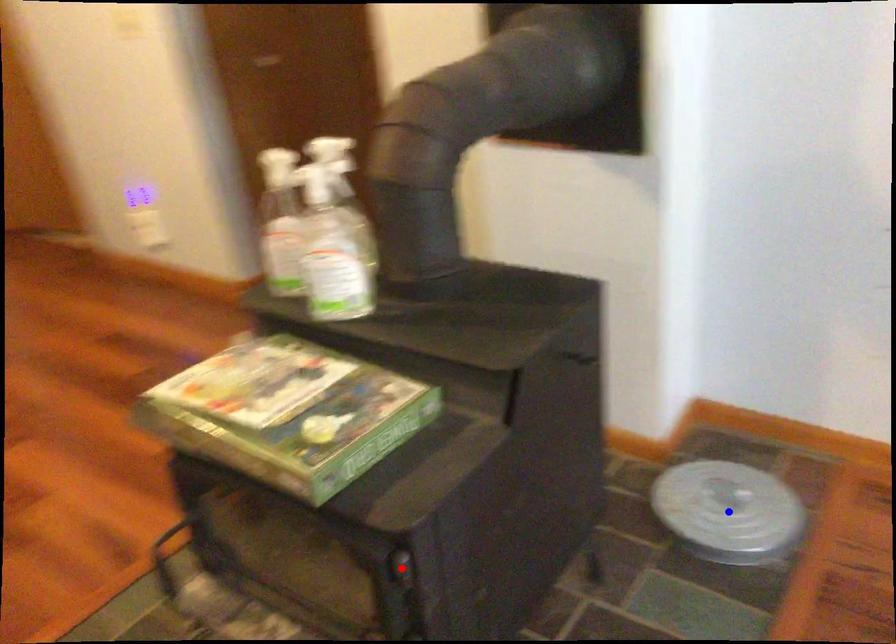
Question: In the image, two points are highlighted. Which point is nearer to the camera? Reply with the corresponding letter.

Choices:
 (A) blue point
 (B) red point

Answer: (B)